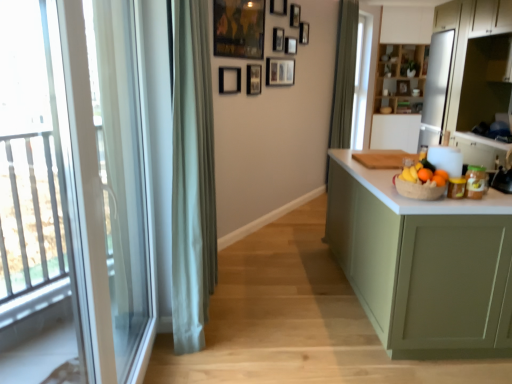
What is the approximate height of wooden picture frame at upper center, positioned as the 9th picture frame in right-to-left order?

It is 19.71 inches.

Identify the location of matte black picture frame at upper center, the eighth picture frame viewed from the right. Image resolution: width=512 pixels, height=384 pixels. (254, 79).

The height and width of the screenshot is (384, 512). Describe the element at coordinates (254, 79) in the screenshot. I see `matte black picture frame at upper center, the 8th picture frame viewed from the back` at that location.

What do you see at coordinates (344, 75) in the screenshot?
I see `green fabric curtain at center, the 2th curtain when ordered from left to right` at bounding box center [344, 75].

You are a GUI agent. You are given a task and a screenshot of the screen. Output one action in this format:
    pyautogui.click(x=<x>, y=<y>)
    Task: Click on the white glossy refrigerator at upper right, which is the third cabinetry from front to back
    This screenshot has width=512, height=384.
    Given the screenshot: What is the action you would take?
    pyautogui.click(x=476, y=71)

Identify the location of wooden picture frame at upper center, the 1th picture frame positioned from the right. (403, 87).

At what (x,y) coordinates should I click in order to perform the action: click on the 9th picture frame counting from the left side of the green fabric curtain at center, the second curtain viewed from the front. Please return your answer as a coordinate pair (x, y). This screenshot has width=512, height=384. Looking at the image, I should click on (229, 80).

Does green fabric curtain at center, the 2th curtain when ordered from left to right, have a lesser height compared to black matte picture frame at upper center, which appears as the 1th picture frame when viewed from the left?

Incorrect, the height of green fabric curtain at center, the 2th curtain when ordered from left to right, does not fall short of that of black matte picture frame at upper center, which appears as the 1th picture frame when viewed from the left.

From a real-world perspective, who is located lower, green fabric curtain at center, the second curtain viewed from the front, or black matte picture frame at upper center, the ninth picture frame in the back-to-front sequence?

green fabric curtain at center, the second curtain viewed from the front, from a real-world perspective.

Consider the image. Could you tell me if green fabric curtain at center, the second curtain viewed from the front, is facing black matte picture frame at upper center, which appears as the 1th picture frame when viewed from the left?

No, green fabric curtain at center, the second curtain viewed from the front, is not oriented towards black matte picture frame at upper center, which appears as the 1th picture frame when viewed from the left.

Is point (425, 168) positioned behind point (458, 52)?

That is False.

From the image's perspective, which object appears higher, orange matte at right, which appears as the 3th orange when viewed from the right, or white glossy refrigerator at upper right, marked as the 1th cabinetry in a right-to-left arrangement?

white glossy refrigerator at upper right, marked as the 1th cabinetry in a right-to-left arrangement, appears higher in the image.

Is orange matte at right, arranged as the first orange when viewed from the left, further to camera compared to white glossy refrigerator at upper right, the 4th cabinetry when ordered from left to right?

No, orange matte at right, arranged as the first orange when viewed from the left, is closer to the viewer.

Considering the sizes of green matte cabinet at right, which appears as the fourth cabinetry when viewed from the right, and white glossy refrigerator at upper right, marked as the 1th cabinetry in a right-to-left arrangement, in the image, is green matte cabinet at right, which appears as the fourth cabinetry when viewed from the right, wider or thinner than white glossy refrigerator at upper right, marked as the 1th cabinetry in a right-to-left arrangement,?

Considering their sizes, green matte cabinet at right, which appears as the fourth cabinetry when viewed from the right, looks broader than white glossy refrigerator at upper right, marked as the 1th cabinetry in a right-to-left arrangement.

Is white glossy refrigerator at upper right, marked as the 1th cabinetry in a right-to-left arrangement, a part of green matte cabinet at right, acting as the 4th cabinetry starting from the back?

No.

Would you consider green matte cabinet at right, acting as the 4th cabinetry starting from the back, to be distant from white glossy refrigerator at upper right, the second cabinetry in the back-to-front sequence?

green matte cabinet at right, acting as the 4th cabinetry starting from the back, is positioned a significant distance from white glossy refrigerator at upper right, the second cabinetry in the back-to-front sequence.

Looking at the image, does green matte cabinet at right, which appears as the fourth cabinetry when viewed from the right, seem bigger or smaller compared to white glossy refrigerator at upper right, the second cabinetry in the back-to-front sequence?

green matte cabinet at right, which appears as the fourth cabinetry when viewed from the right, is smaller than white glossy refrigerator at upper right, the second cabinetry in the back-to-front sequence.

From the image's perspective, does wooden picture frame at upper center, positioned as the 9th picture frame in right-to-left order, appear lower than matte black picture frame at upper center, arranged as the seventh picture frame when viewed from the right?

Yes.

Is wooden picture frame at upper center, which is the 1th picture frame from front to back, with matte black picture frame at upper center, arranged as the seventh picture frame when viewed from the right?

No, wooden picture frame at upper center, which is the 1th picture frame from front to back, is not next to matte black picture frame at upper center, arranged as the seventh picture frame when viewed from the right.

Between point (239, 24) and point (283, 11), which one is positioned in front?

The point (239, 24) is closer.

From a real-world perspective, between wooden picture frame at upper center, the 1th picture frame viewed from the back, and matte black picture frame at upper center, the eighth picture frame viewed from the right, who is vertically lower?

wooden picture frame at upper center, the 1th picture frame viewed from the back, is physically lower.

Considering the points (401, 82) and (248, 78), which point is behind, point (401, 82) or point (248, 78)?

The point (401, 82) is farther from the camera.

The image size is (512, 384). I want to click on the 2nd picture frame directly beneath the matte black picture frame at upper center, the eighth picture frame viewed from the right (from a real-world perspective), so click(x=403, y=87).

Does wooden picture frame at upper center, the 1th picture frame viewed from the back, contain matte black picture frame at upper center, the eighth picture frame viewed from the right?

Definitely not — matte black picture frame at upper center, the eighth picture frame viewed from the right, is not inside wooden picture frame at upper center, the 1th picture frame viewed from the back.

Would you say wooden picture frame at upper center, the 6th picture frame viewed from the front, contains black matte picture frame at upper center, which appears as the 1th picture frame when viewed from the left?

No, black matte picture frame at upper center, which appears as the 1th picture frame when viewed from the left, is not surrounded by wooden picture frame at upper center, the 6th picture frame viewed from the front.

Can you tell me how much wooden picture frame at upper center, the sixth picture frame when ordered from right to left, and black matte picture frame at upper center, which appears as the 1th picture frame when viewed from the left, differ in facing direction?

The angular difference between wooden picture frame at upper center, the sixth picture frame when ordered from right to left, and black matte picture frame at upper center, which appears as the 1th picture frame when viewed from the left, is 0.426 degrees.

In terms of height, does wooden picture frame at upper center, the sixth picture frame when ordered from right to left, look taller or shorter compared to black matte picture frame at upper center, the ninth picture frame in the back-to-front sequence?

Clearly, wooden picture frame at upper center, the sixth picture frame when ordered from right to left, is shorter compared to black matte picture frame at upper center, the ninth picture frame in the back-to-front sequence.

You are a GUI agent. You are given a task and a screenshot of the screen. Output one action in this format:
    pyautogui.click(x=<x>, y=<y>)
    Task: Click on the 4th picture frame positioned below the wooden picture frame at upper center, the sixth picture frame when ordered from right to left (from a real-world perspective)
    This screenshot has height=384, width=512.
    Given the screenshot: What is the action you would take?
    pyautogui.click(x=229, y=80)

In the scene shown: Can you confirm if wooden picture frame at upper center, which is the 10th picture frame from left to right, is taller than transparent glass screen door at left?

No.

Would you say wooden picture frame at upper center, which is the 10th picture frame from left to right, is to the left or to the right of transparent glass screen door at left in the picture?

wooden picture frame at upper center, which is the 10th picture frame from left to right, is to the right of transparent glass screen door at left.

Considering the sizes of objects wooden picture frame at upper center, the 1th picture frame viewed from the back, and transparent glass screen door at left in the image provided, who is wider, wooden picture frame at upper center, the 1th picture frame viewed from the back, or transparent glass screen door at left?

wooden picture frame at upper center, the 1th picture frame viewed from the back, is wider.

From a real-world perspective, which object rests below the other?

In real-world perspective, transparent glass screen door at left is lower.

From a real-world perspective, which picture frame is the 2nd one above the green fabric curtain at center, the 2th curtain when ordered from left to right? Please provide its 2D coordinates.

[(229, 80)]

From the image's perspective, which cabinetry is the 1st one above the orange matte at right, which appears as the 3th orange when viewed from the right? Please provide its 2D coordinates.

[(476, 71)]

Estimate the real-world distances between objects in this image. Which object is further from wooden picture frame at upper center, the sixth picture frame when ordered from right to left, orange matte at right, which is the 2th orange in left-to-right order, or black matte picture frame at upper center, positioned as the 10th picture frame in right-to-left order?

orange matte at right, which is the 2th orange in left-to-right order, lies further to wooden picture frame at upper center, the sixth picture frame when ordered from right to left, than the other object.

Which object lies nearer to the anchor point orange matte at right, which is the 2th orange in left-to-right order, green fabric curtain at center, positioned as the 1th curtain in left-to-right order, or green fabric curtain at center, positioned as the first curtain in right-to-left order?

Among the two, green fabric curtain at center, positioned as the 1th curtain in left-to-right order, is located nearer to orange matte at right, which is the 2th orange in left-to-right order.

Based on their spatial positions, is matte white drawer at upper right or green matte cabinet at right, positioned as the 1th cabinetry in front-to-back order, closer to wooden picture frame at upper center, which is the fifth picture frame from left to right?

matte white drawer at upper right is positioned closer to the anchor wooden picture frame at upper center, which is the fifth picture frame from left to right.

Estimate the real-world distances between objects in this image. Which object is closer to white glossy refrigerator at upper right, the 4th cabinetry when ordered from left to right, orange matte at right, the 1th orange when ordered from right to left, or green matte cabinet at right, positioned as the 1th cabinetry in front-to-back order?

green matte cabinet at right, positioned as the 1th cabinetry in front-to-back order, is closer to white glossy refrigerator at upper right, the 4th cabinetry when ordered from left to right.

Estimate the real-world distances between objects in this image. Which object is further from orange matte at right, which appears as the 3th orange when viewed from the right, matte black picture frame at upper center, the 5th picture frame positioned from the front, or wooden picture frame at upper center, which is the 3th picture frame in back-to-front order?

Based on the image, wooden picture frame at upper center, which is the 3th picture frame in back-to-front order, appears to be further to orange matte at right, which appears as the 3th orange when viewed from the right.

Which object lies further to the anchor point wooden picture frame at upper center, which is the 1th picture frame from front to back, orange matte at right, the 1th orange when ordered from right to left, or orange matte at right, which is the 2th orange in left-to-right order?

orange matte at right, which is the 2th orange in left-to-right order, is further to wooden picture frame at upper center, which is the 1th picture frame from front to back.

Looking at the image, which one is located closer to green matte cabinet at right, which is counted as the 1th cabinetry, starting from the left, matte black picture frame at upper center, the 4th picture frame when ordered from left to right, or matte black picture frame at upper center, the 8th picture frame viewed from the back?

The object closer to green matte cabinet at right, which is counted as the 1th cabinetry, starting from the left, is matte black picture frame at upper center, the 8th picture frame viewed from the back.

When comparing their distances from black matte picture frame at upper center, the ninth picture frame in the back-to-front sequence, does wooden picture frame at upper center, the 9th picture frame in the front-to-back sequence, or wooden picture frame at upper center, positioned as the 9th picture frame in right-to-left order, seem closer?

wooden picture frame at upper center, positioned as the 9th picture frame in right-to-left order, is positioned closer to the anchor black matte picture frame at upper center, the ninth picture frame in the back-to-front sequence.

This screenshot has width=512, height=384. In order to click on curtain positioned between green matte cabinet at right, acting as the 4th cabinetry starting from the back, and wooden shelves at upper center, the 3th cabinetry from the right, from near to far in this screenshot , I will do `click(344, 75)`.

Where is `curtain between transparent glass screen door at left and wooden picture frame at upper center, which is counted as the third picture frame, starting from the right, along the z-axis`? Image resolution: width=512 pixels, height=384 pixels. curtain between transparent glass screen door at left and wooden picture frame at upper center, which is counted as the third picture frame, starting from the right, along the z-axis is located at coordinates (192, 178).

This screenshot has height=384, width=512. Find the location of `cabinetry positioned between orange matte at right, which appears as the 3th orange when viewed from the right, and matte white drawer at upper right from near to far`. cabinetry positioned between orange matte at right, which appears as the 3th orange when viewed from the right, and matte white drawer at upper right from near to far is located at coordinates (490, 17).

Where is `curtain between wooden picture frame at upper center, which is the 2th picture frame from right to left, and wooden picture frame at upper center, which is the 10th picture frame from left to right, from front to back`? The height and width of the screenshot is (384, 512). curtain between wooden picture frame at upper center, which is the 2th picture frame from right to left, and wooden picture frame at upper center, which is the 10th picture frame from left to right, from front to back is located at coordinates (344, 75).